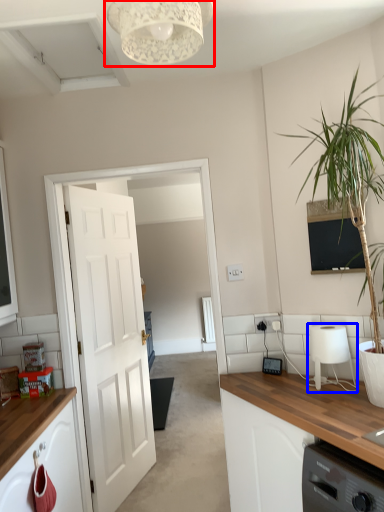
Question: Which of the following is the closest to the observer, light fixture (highlighted by a red box) or appliance (highlighted by a blue box)?

Choices:
 (A) light fixture
 (B) appliance

Answer: (A)